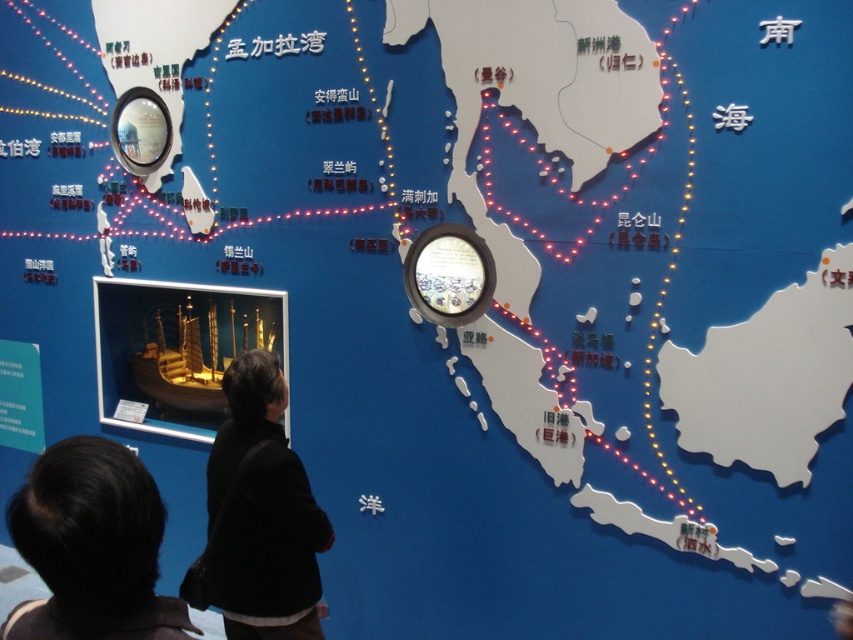
You are standing in front of an educational display about historical maritime routes. You see a black fabric at lower left and a wooden ship at center. Which object is positioned lower in the scene?

The black fabric at lower left is located below the wooden ship at center, so it is positioned lower in the scene.

You are standing in front of an educational display about historical maritime routes in Southeast Asia. There is a point marked at coordinates point (67, 509). If you want to touch this point with a 1.2 meter long stick, will you be able to reach it?

The distance between you and the point (67, 509) is 1.18 meters. Since the stick is 1.2 meters long, you can reach the point with the stick.

What is the position of the black hair at lower left in the image?

The black hair at lower left is located at point (91, 547).